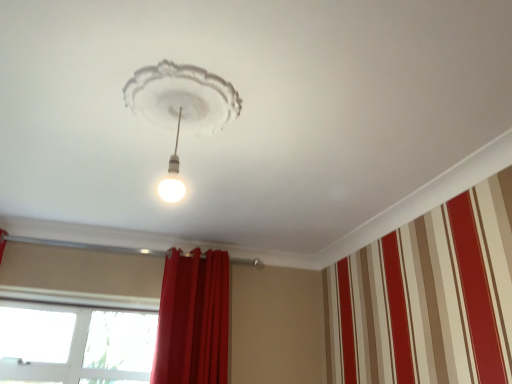
Question: Does red velvet curtain at center turn towards white glossy light bulb at center?

Choices:
 (A) yes
 (B) no

Answer: (A)

Question: Does red velvet curtain at center have a lesser height compared to white glossy light bulb at center?

Choices:
 (A) yes
 (B) no

Answer: (B)

Question: Would you consider red velvet curtain at center to be distant from white glossy light bulb at center?

Choices:
 (A) no
 (B) yes

Answer: (B)

Question: Considering the relative sizes of red velvet curtain at center and white glossy light bulb at center in the image provided, is red velvet curtain at center smaller than white glossy light bulb at center?

Choices:
 (A) no
 (B) yes

Answer: (A)

Question: Is red velvet curtain at center oriented away from white glossy light bulb at center?

Choices:
 (A) yes
 (B) no

Answer: (B)

Question: Is red velvet curtain at center closer to camera compared to white glossy light bulb at center?

Choices:
 (A) yes
 (B) no

Answer: (B)

Question: Is red velvet curtain at center looking in the opposite direction of transparent glass window at lower left?

Choices:
 (A) no
 (B) yes

Answer: (A)

Question: Is the position of red velvet curtain at center more distant than that of transparent glass window at lower left?

Choices:
 (A) no
 (B) yes

Answer: (A)

Question: Does red velvet curtain at center have a lesser width compared to transparent glass window at lower left?

Choices:
 (A) yes
 (B) no

Answer: (B)

Question: Considering the relative sizes of red velvet curtain at center and transparent glass window at lower left in the image provided, is red velvet curtain at center taller than transparent glass window at lower left?

Choices:
 (A) no
 (B) yes

Answer: (B)

Question: Is red velvet curtain at center at the right side of transparent glass window at lower left?

Choices:
 (A) yes
 (B) no

Answer: (A)

Question: From the image's perspective, would you say red velvet curtain at center is shown under transparent glass window at lower left?

Choices:
 (A) yes
 (B) no

Answer: (B)

Question: From a real-world perspective, is white glossy light bulb at center physically below transparent glass window at lower left?

Choices:
 (A) yes
 (B) no

Answer: (B)